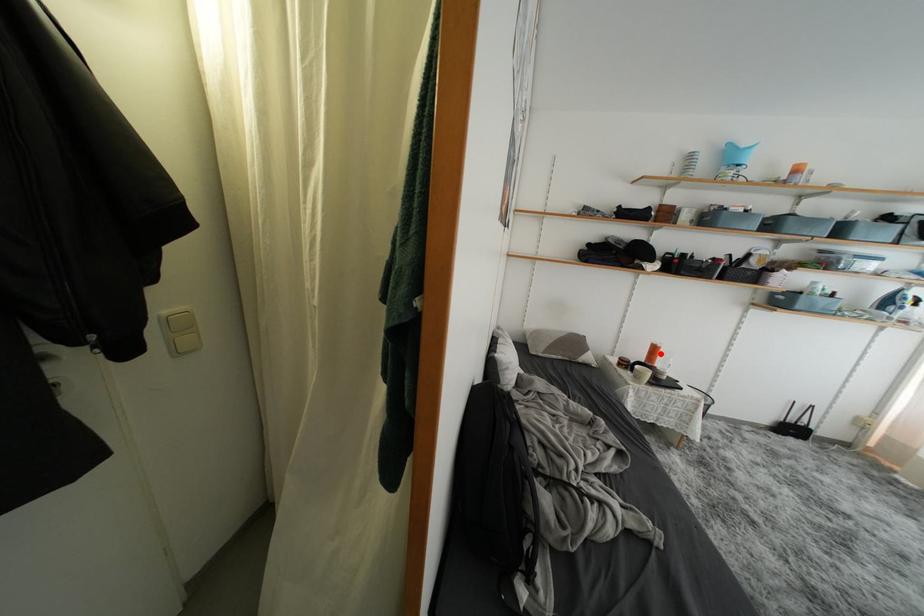
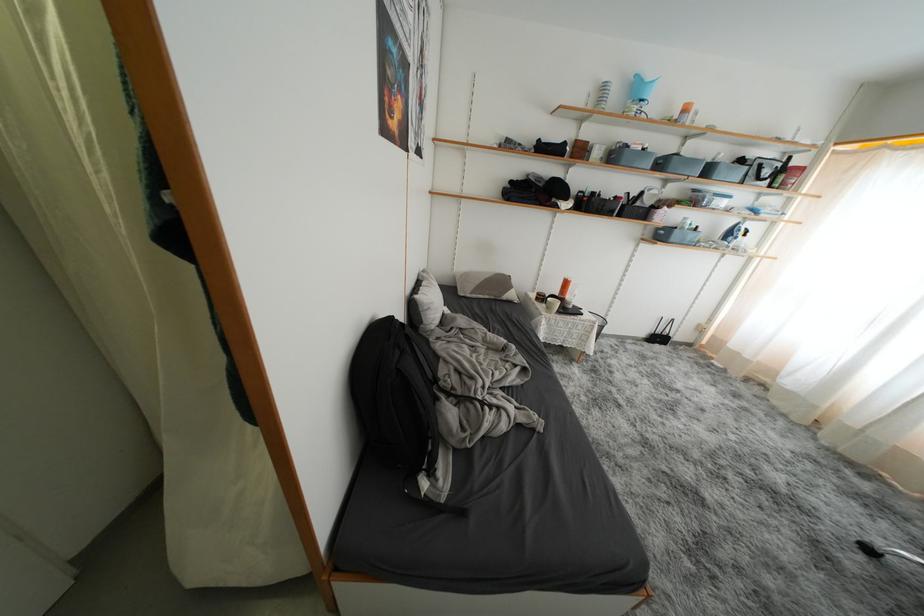
Question: I am providing you with two images of the same scene from different viewpoints. A red point is marked on the first image. Is the red point's position out of view in image 2?

Choices:
 (A) Yes
 (B) No

Answer: (B)